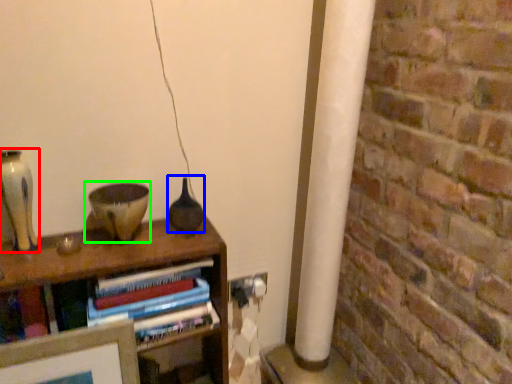
Question: Based on their relative distances, which object is nearer to glass vase (highlighted by a red box)? Choose from glass vase (highlighted by a blue box) and candle holder (highlighted by a green box).

Choices:
 (A) glass vase
 (B) candle holder

Answer: (B)